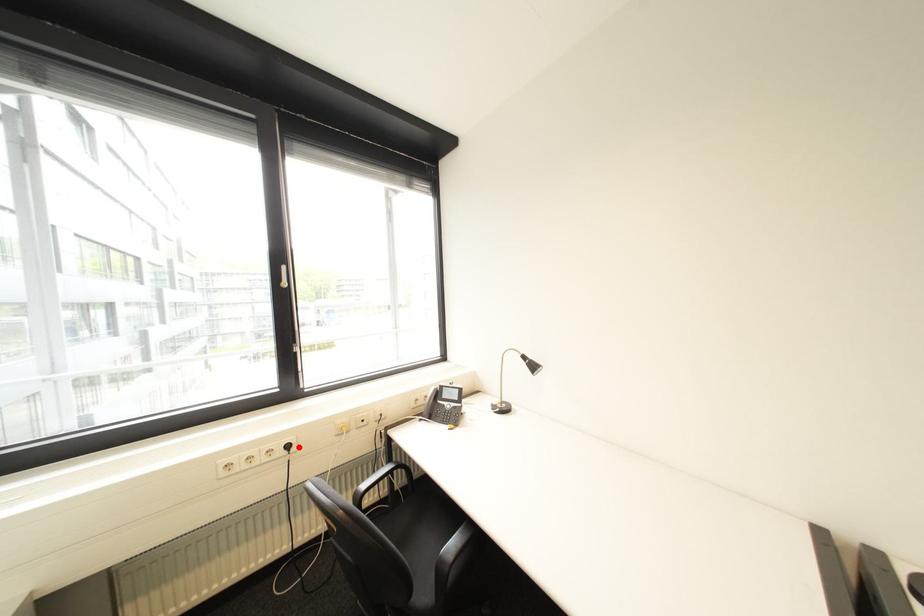
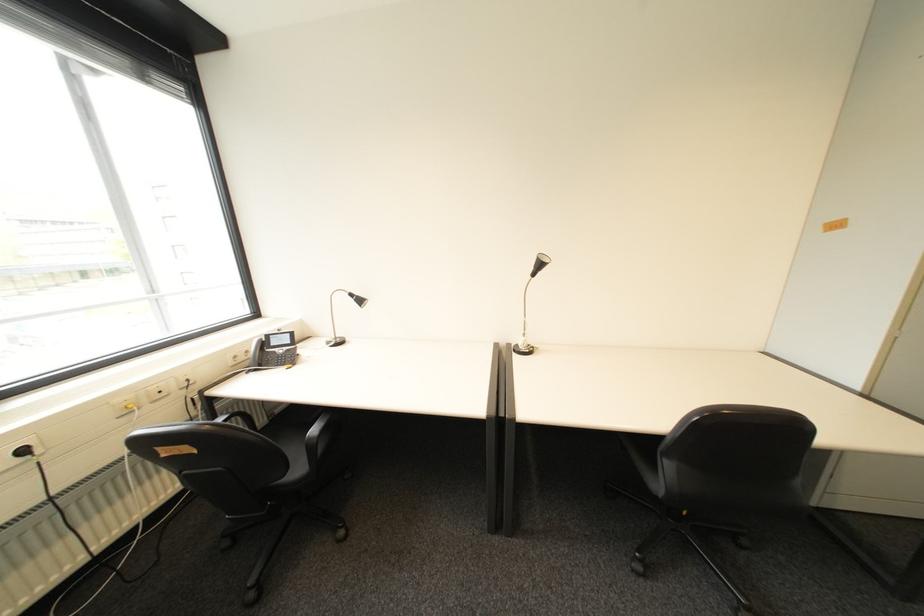
The point at the highlighted location is marked in the first image. Where is the corresponding point in the second image?

(34, 452)